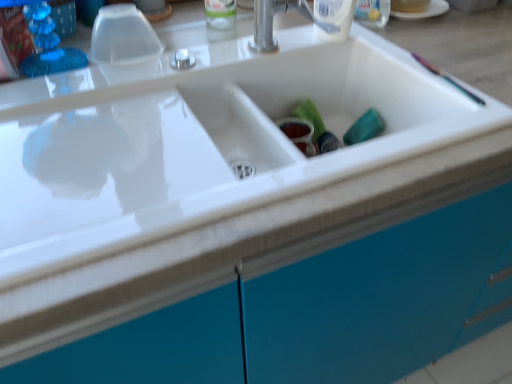
Describe the element at coordinates (334, 18) in the screenshot. This screenshot has height=384, width=512. I see `white glossy bottle at upper right` at that location.

This screenshot has width=512, height=384. I want to click on white glossy bottle at upper right, so click(x=334, y=18).

Where is `white glossy bottle at upper right`? The height and width of the screenshot is (384, 512). white glossy bottle at upper right is located at coordinates (334, 18).